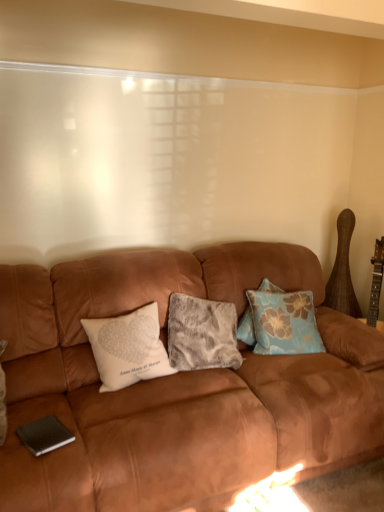
Question: Is blue floral fabric pillow at center, which is counted as the third pillow, starting from the left, bigger or smaller than suede brown couch at center?

Choices:
 (A) small
 (B) big

Answer: (A)

Question: Is blue floral fabric pillow at center, which is counted as the third pillow, starting from the left, taller or shorter than suede brown couch at center?

Choices:
 (A) tall
 (B) short

Answer: (B)

Question: Estimate the real-world distances between objects in this image. Which object is closer to the blue floral fabric pillow at center, which is counted as the 1th pillow, starting from the right?

Choices:
 (A) white printed pillow at center, marked as the 1th pillow in a left-to-right arrangement
 (B) fuzzy gray pillow at center, marked as the 2th pillow in a left-to-right arrangement
 (C) suede brown couch at center

Answer: (B)

Question: Estimate the real-world distances between objects in this image. Which object is farther from the blue floral fabric pillow at center, which is counted as the third pillow, starting from the left?

Choices:
 (A) white printed pillow at center, the third pillow when ordered from right to left
 (B) suede brown couch at center
 (C) fuzzy gray pillow at center, which is counted as the second pillow, starting from the right

Answer: (A)